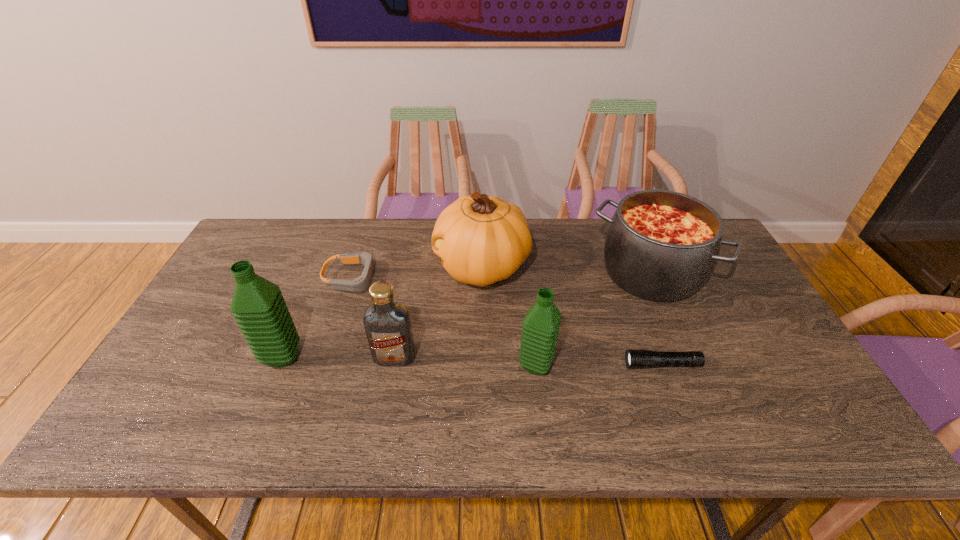
Please point a spot on the right to add another water bottle. Please provide its 2D coordinates. Your answer should be formatted as a tuple, i.e. [(x, y)], where the tuple contains the x and y coordinates of a point satisfying the conditions above.

[(800, 375)]